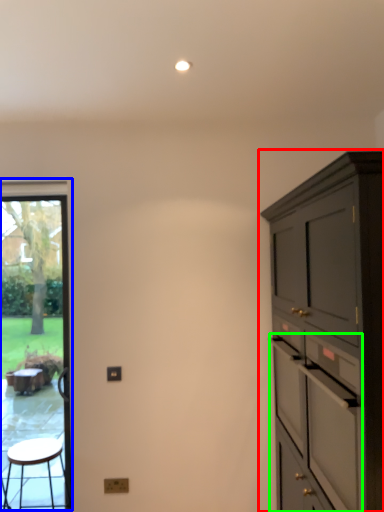
Question: Considering the real-world distances, which object is farthest from cabinetry (highlighted by a red box)? window screen (highlighted by a blue box) or drawer (highlighted by a green box)?

Choices:
 (A) window screen
 (B) drawer

Answer: (A)